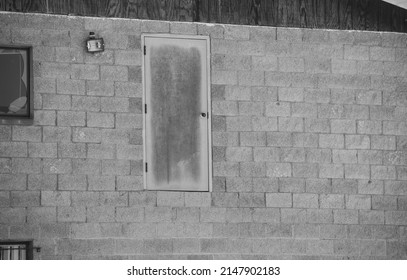
Where is `light`? light is located at coordinates (91, 45).